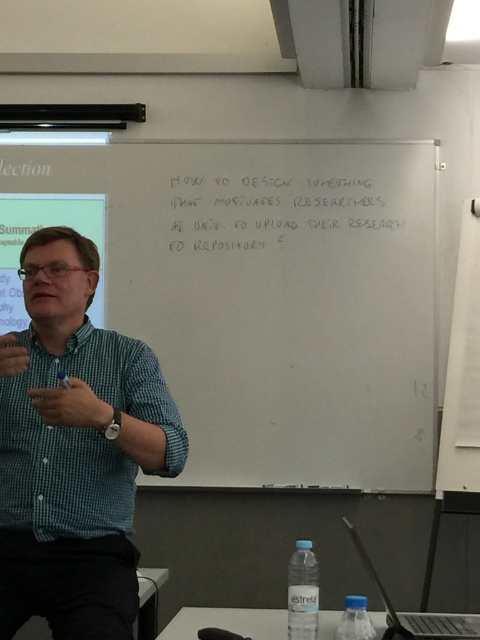
Does whiteboard at upper center have a lesser width compared to green checkered shirt at left?

No.

From the picture: Can you confirm if whiteboard at upper center is smaller than green checkered shirt at left?

Incorrect, whiteboard at upper center is not smaller in size than green checkered shirt at left.

Who is more forward, (208, 452) or (180, 420)?

Point (180, 420) is in front.

Identify the location of whiteboard at upper center. The height and width of the screenshot is (640, 480). (274, 298).

Which is behind, point (20, 500) or point (220, 204)?

Point (220, 204)

Which is in front, point (92, 442) or point (256, 188)?

Positioned in front is point (92, 442).

Between point (79, 440) and point (256, 248), which one is positioned behind?

The point (256, 248) is more distant.

Locate an element on the screen. The width and height of the screenshot is (480, 640). green checkered shirt at left is located at coordinates (81, 436).

Locate an element on the screen. The height and width of the screenshot is (640, 480). whiteboard at upper center is located at coordinates (274, 298).

Does point (167, 372) come in front of point (268, 227)?

Yes, point (167, 372) is in front of point (268, 227).

Locate an element on the screen. whiteboard at upper center is located at coordinates (274, 298).